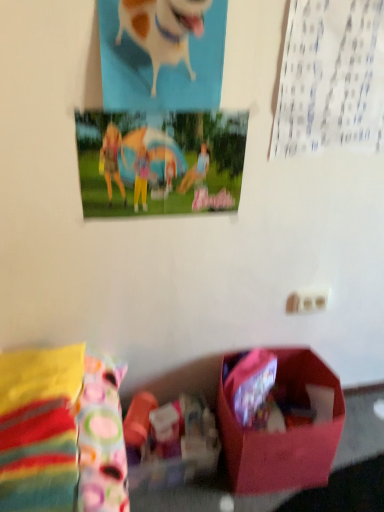
At what (x,y) coordinates should I click in order to perform the action: click on white glossy dog at upper center. Please return your answer as a coordinate pair (x, y). Looking at the image, I should click on (163, 29).

Considering the sizes of objects matte plastic poster at upper center and matte pink box at lower center in the image provided, who is wider, matte plastic poster at upper center or matte pink box at lower center?

Wider between the two is matte pink box at lower center.

Who is shorter, matte plastic poster at upper center or matte pink box at lower center?

matte plastic poster at upper center is shorter.

Is matte plastic poster at upper center located outside matte pink box at lower center?

matte plastic poster at upper center lies outside matte pink box at lower center's area.

Would you say matte plastic poster at upper center is a long distance from matte pink box at lower center?

No.

In terms of width, does white glossy dog at upper center look wider or thinner when compared to matte pink box at lower center?

Considering their sizes, white glossy dog at upper center looks slimmer than matte pink box at lower center.

Which is less distant, [181,48] or [288,456]?

The point [181,48] is closer.

From their relative heights in the image, would you say white glossy dog at upper center is taller or shorter than matte pink box at lower center?

Considering their sizes, white glossy dog at upper center has more height than matte pink box at lower center.

From the image's perspective, which one is positioned higher, white glossy dog at upper center or matte plastic poster at upper center?

white glossy dog at upper center, from the image's perspective.

Is point (165, 31) behind point (117, 203)?

No, it is in front of (117, 203).

Who is shorter, white glossy dog at upper center or matte plastic poster at upper center?

matte plastic poster at upper center.

Considering the relative sizes of white glossy dog at upper center and matte plastic poster at upper center in the image provided, is white glossy dog at upper center bigger than matte plastic poster at upper center?

Yes, white glossy dog at upper center is bigger than matte plastic poster at upper center.

Are matte pink box at lower center and white glossy dog at upper center located far from each other?

Yes, matte pink box at lower center is far from white glossy dog at upper center.

From the image's perspective, is matte pink box at lower center under white glossy dog at upper center?

Yes, from the image's perspective, matte pink box at lower center is below white glossy dog at upper center.

Which is less distant, [276,452] or [161,30]?

The point [161,30] is in front.

Could white glossy dog at upper center be considered to be inside matte pink box at lower center?

Definitely not — white glossy dog at upper center is not inside matte pink box at lower center.

The width and height of the screenshot is (384, 512). Identify the location of postcard that is on the left side of matte pink box at lower center. (160, 162).

How distant is matte pink box at lower center from matte plastic poster at upper center?

They are 28.86 inches apart.

Which of these two, matte pink box at lower center or matte plastic poster at upper center, is bigger?

With larger size is matte pink box at lower center.

Identify the location of postcard behind the white glossy dog at upper center. (160, 162).

Is matte plastic poster at upper center positioned far away from white glossy dog at upper center?

No, matte plastic poster at upper center is not far from white glossy dog at upper center.

Does matte plastic poster at upper center have a lesser height compared to white glossy dog at upper center?

Correct, matte plastic poster at upper center is not as tall as white glossy dog at upper center.

Between matte plastic poster at upper center and white glossy dog at upper center, which one is positioned in front?

white glossy dog at upper center is in front.

The width and height of the screenshot is (384, 512). Identify the location of postcard located above the matte pink box at lower center (from a real-world perspective). (160, 162).

The width and height of the screenshot is (384, 512). Identify the location of box below the white glossy dog at upper center (from the image's perspective). (283, 433).

Estimate the real-world distances between objects in this image. Which object is closer to white glossy dog at upper center, matte pink box at lower center or matte plastic poster at upper center?

Among the two, matte plastic poster at upper center is located nearer to white glossy dog at upper center.

In the scene shown: When comparing their distances from matte plastic poster at upper center, does matte pink box at lower center or white glossy dog at upper center seem closer?

white glossy dog at upper center is positioned closer to the anchor matte plastic poster at upper center.

Considering their positions, is white glossy dog at upper center positioned further to matte pink box at lower center than matte plastic poster at upper center?

The object further to matte pink box at lower center is white glossy dog at upper center.

Looking at the image, which one is located further to white glossy dog at upper center, matte plastic poster at upper center or matte pink box at lower center?

matte pink box at lower center is positioned further to the anchor white glossy dog at upper center.

In the scene shown: Estimate the real-world distances between objects in this image. Which object is further from matte pink box at lower center, matte plastic poster at upper center or white glossy dog at upper center?

Among the two, white glossy dog at upper center is located further to matte pink box at lower center.

Considering their positions, is white glossy dog at upper center positioned further to matte plastic poster at upper center than matte pink box at lower center?

matte pink box at lower center is positioned further to the anchor matte plastic poster at upper center.

The image size is (384, 512). I want to click on postcard that lies between white glossy dog at upper center and matte pink box at lower center from top to bottom, so click(160, 162).